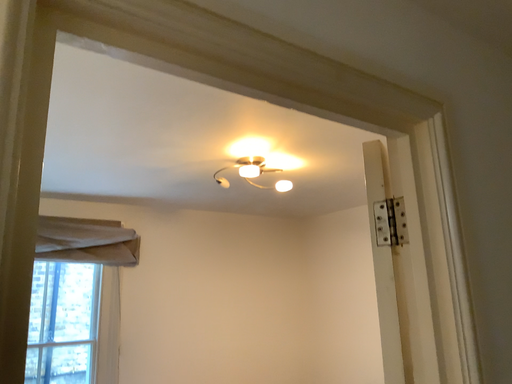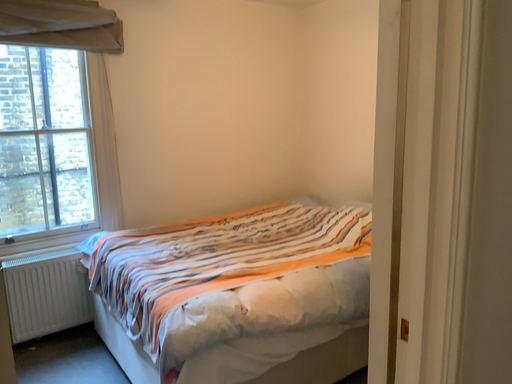
Question: Which way did the camera rotate in the video?

Choices:
 (A) rotated downward
 (B) rotated upward

Answer: (A)